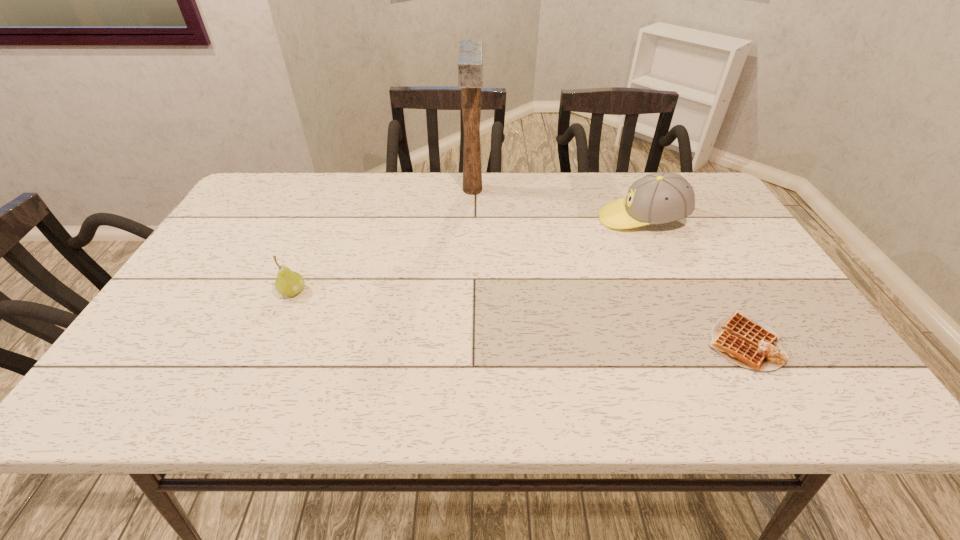
Locate an element on the screen. unoccupied area between the third object from right to left and the third shortest object is located at coordinates (557, 205).

The height and width of the screenshot is (540, 960). Identify the location of free area in between the mallet and the waffle. (608, 267).

Locate an element on the screen. Image resolution: width=960 pixels, height=540 pixels. free spot between the third tallest object and the tallest object is located at coordinates (383, 241).

Locate an element on the screen. free space between the leftmost object and the mallet is located at coordinates (383, 241).

This screenshot has height=540, width=960. I want to click on free spot between the shortest object and the baseball cap, so click(692, 281).

Identify which object is located as the second nearest to the waffle. Please provide its 2D coordinates. Your answer should be formatted as a tuple, i.e. [(x, y)], where the tuple contains the x and y coordinates of a point satisfying the conditions above.

[(470, 52)]

Locate which object is the second closest to the second tallest object. Please provide its 2D coordinates. Your answer should be formatted as a tuple, i.e. [(x, y)], where the tuple contains the x and y coordinates of a point satisfying the conditions above.

[(470, 52)]

The width and height of the screenshot is (960, 540). I want to click on free point that satisfies the following two spatial constraints: 1. on the front side of the second shortest object; 2. on the left side of the shortest object, so pyautogui.click(x=270, y=343).

I want to click on vacant point that satisfies the following two spatial constraints: 1. on the front side of the nearest object; 2. on the right side of the leftmost object, so click(270, 343).

Where is `free space that satisfies the following two spatial constraints: 1. on the front-facing side of the nearest object; 2. on the right side of the baseball cap`? The height and width of the screenshot is (540, 960). free space that satisfies the following two spatial constraints: 1. on the front-facing side of the nearest object; 2. on the right side of the baseball cap is located at coordinates (699, 343).